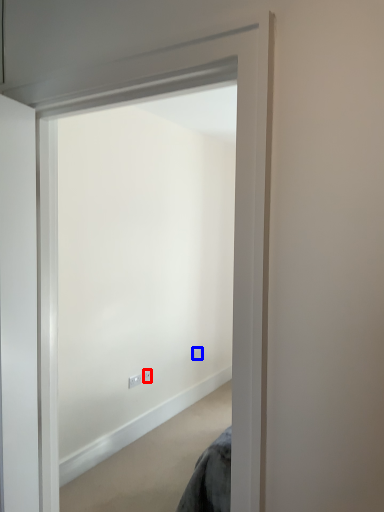
Question: Which of the following is the closest to the observer, electric outlet (highlighted by a red box) or electric outlet (highlighted by a blue box)?

Choices:
 (A) electric outlet
 (B) electric outlet

Answer: (A)